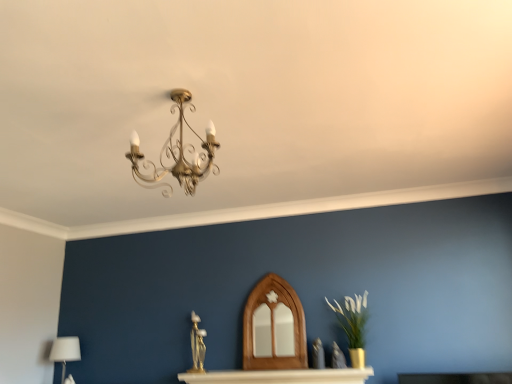
Question: Should I look upward or downward to see white fabric lampshade at lower left?

Choices:
 (A) down
 (B) up

Answer: (A)

Question: Does green matte vase at right have a lesser height compared to gold metallic chandelier at upper center?

Choices:
 (A) yes
 (B) no

Answer: (B)

Question: From a real-world perspective, is green matte vase at right over gold metallic chandelier at upper center?

Choices:
 (A) no
 (B) yes

Answer: (A)

Question: Is green matte vase at right smaller than gold metallic chandelier at upper center?

Choices:
 (A) yes
 (B) no

Answer: (A)

Question: Is green matte vase at right at the left side of gold metallic chandelier at upper center?

Choices:
 (A) no
 (B) yes

Answer: (A)

Question: Considering the relative sizes of green matte vase at right and gold metallic chandelier at upper center in the image provided, is green matte vase at right thinner than gold metallic chandelier at upper center?

Choices:
 (A) no
 (B) yes

Answer: (B)

Question: Is green matte vase at right far away from gold metallic chandelier at upper center?

Choices:
 (A) yes
 (B) no

Answer: (A)

Question: Is green matte vase at right located within white fabric lampshade at lower left?

Choices:
 (A) yes
 (B) no

Answer: (B)

Question: Would you say white fabric lampshade at lower left is a long distance from green matte vase at right?

Choices:
 (A) no
 (B) yes

Answer: (B)

Question: Is white fabric lampshade at lower left further to the viewer compared to green matte vase at right?

Choices:
 (A) yes
 (B) no

Answer: (A)

Question: Is white fabric lampshade at lower left taller than green matte vase at right?

Choices:
 (A) no
 (B) yes

Answer: (A)

Question: Considering the relative sizes of white fabric lampshade at lower left and green matte vase at right in the image provided, is white fabric lampshade at lower left wider than green matte vase at right?

Choices:
 (A) yes
 (B) no

Answer: (A)

Question: From the image's perspective, is white fabric lampshade at lower left over green matte vase at right?

Choices:
 (A) yes
 (B) no

Answer: (B)

Question: Is green matte vase at right next to white fabric lampshade at lower left?

Choices:
 (A) yes
 (B) no

Answer: (B)